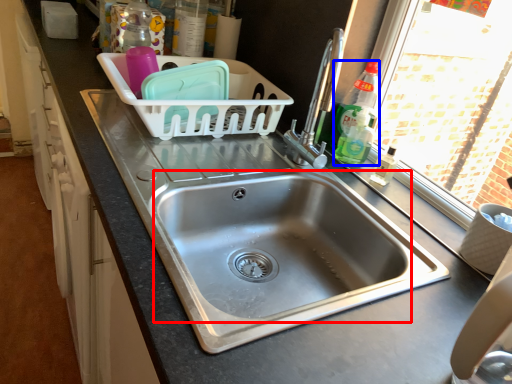
Question: Which object appears farthest to the camera in this image, sink (highlighted by a red box) or bottle (highlighted by a blue box)?

Choices:
 (A) sink
 (B) bottle

Answer: (B)